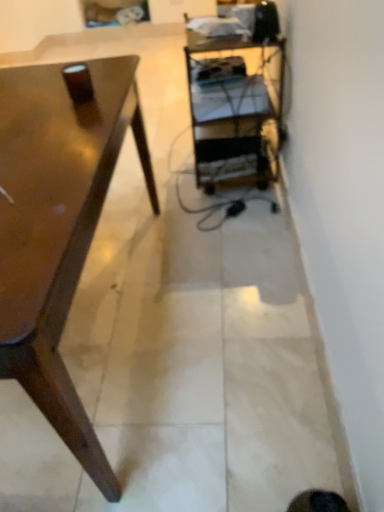
Question: Should I look upward or downward to see metallic silver shelf at center?

Choices:
 (A) up
 (B) down

Answer: (A)

Question: Is glossy wood desk at left behind metallic silver shelf at center?

Choices:
 (A) no
 (B) yes

Answer: (A)

Question: From a real-world perspective, is glossy wood desk at left positioned over metallic silver shelf at center based on gravity?

Choices:
 (A) no
 (B) yes

Answer: (B)

Question: Are glossy wood desk at left and metallic silver shelf at center far apart?

Choices:
 (A) no
 (B) yes

Answer: (A)

Question: Can you confirm if glossy wood desk at left is positioned to the right of metallic silver shelf at center?

Choices:
 (A) no
 (B) yes

Answer: (A)

Question: Is glossy wood desk at left taller than metallic silver shelf at center?

Choices:
 (A) no
 (B) yes

Answer: (A)

Question: Is glossy wood desk at left wider than metallic silver shelf at center?

Choices:
 (A) yes
 (B) no

Answer: (A)

Question: Does metallic silver shelf at center have a larger size compared to glossy wood desk at left?

Choices:
 (A) no
 (B) yes

Answer: (A)

Question: Does metallic silver shelf at center have a greater width compared to glossy wood desk at left?

Choices:
 (A) no
 (B) yes

Answer: (A)

Question: From the image's perspective, is metallic silver shelf at center on top of glossy wood desk at left?

Choices:
 (A) no
 (B) yes

Answer: (B)

Question: Considering the relative sizes of metallic silver shelf at center and glossy wood desk at left in the image provided, is metallic silver shelf at center taller than glossy wood desk at left?

Choices:
 (A) yes
 (B) no

Answer: (A)

Question: From the image's perspective, does metallic silver shelf at center appear lower than glossy wood desk at left?

Choices:
 (A) no
 (B) yes

Answer: (A)

Question: From a real-world perspective, is metallic silver shelf at center over glossy wood desk at left?

Choices:
 (A) no
 (B) yes

Answer: (A)

Question: From the image's perspective, is glossy wood desk at left above or below metallic silver shelf at center?

Choices:
 (A) above
 (B) below

Answer: (B)